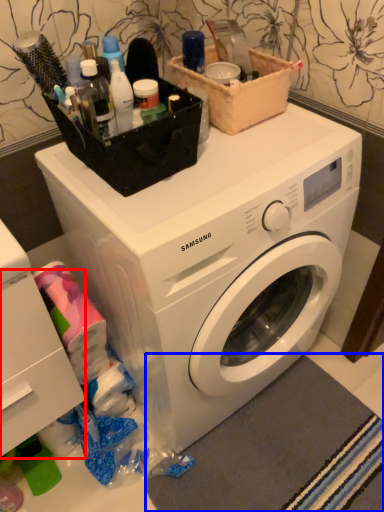
Question: Among these objects, which one is farthest to the camera, drawer (highlighted by a red box) or bath mat (highlighted by a blue box)?

Choices:
 (A) drawer
 (B) bath mat

Answer: (B)